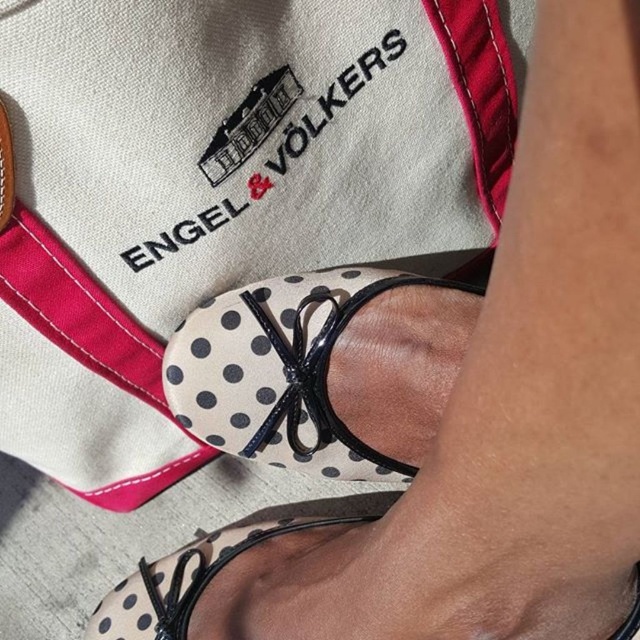
Question: Does white dotted fabric sandal at center have a lesser width compared to white dotted fabric at lower center?

Choices:
 (A) no
 (B) yes

Answer: (B)

Question: Which object appears closest to the camera in this image?

Choices:
 (A) white dotted fabric at lower center
 (B) white dotted fabric sandal at center

Answer: (B)

Question: Which point appears closest to the camera in this image?

Choices:
 (A) (138, 604)
 (B) (182, 403)

Answer: (B)

Question: Considering the relative positions of white dotted fabric sandal at center and white dotted fabric at lower center in the image provided, where is white dotted fabric sandal at center located with respect to white dotted fabric at lower center?

Choices:
 (A) above
 (B) below

Answer: (A)

Question: Which object is closer to the camera taking this photo?

Choices:
 (A) white dotted fabric sandal at center
 (B) white dotted fabric at lower center

Answer: (A)

Question: Can you confirm if white dotted fabric sandal at center is thinner than white dotted fabric at lower center?

Choices:
 (A) yes
 (B) no

Answer: (A)